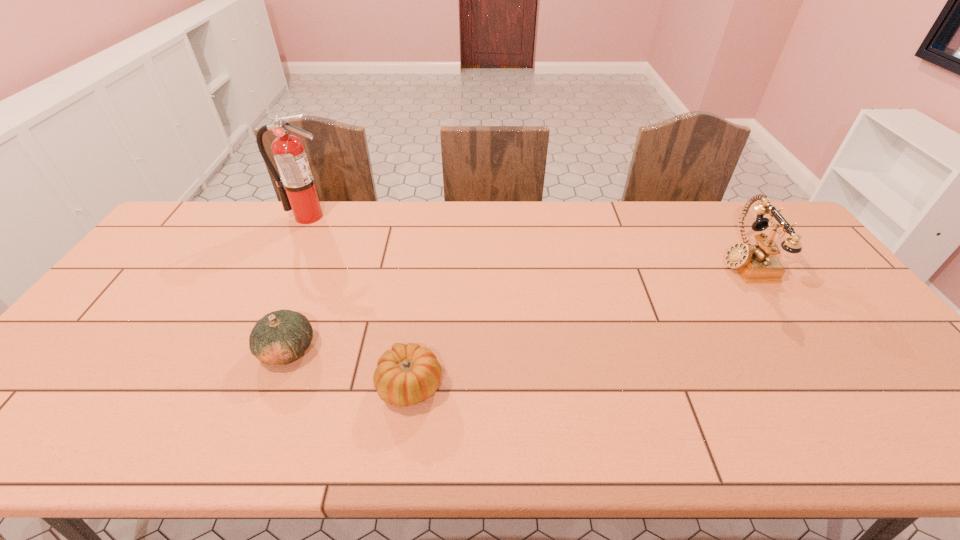
Identify the location of free location located 0.350m on the dial number of the third nearest object. (607, 261).

You are a GUI agent. You are given a task and a screenshot of the screen. Output one action in this format:
    pyautogui.click(x=<x>, y=<y>)
    Task: Click on the vacant space situated 0.170m on the dial number of the third nearest object
    The width and height of the screenshot is (960, 540).
    Given the screenshot: What is the action you would take?
    pyautogui.click(x=665, y=261)

Identify the location of vacant space located on the back of the left gourd. (307, 300).

I want to click on vacant space located 0.360m on the back of the shortest object, so click(427, 264).

The width and height of the screenshot is (960, 540). What are the coordinates of `fire extinguisher located at the far edge` in the screenshot? It's located at (296, 187).

Identify the location of telephone positioned at the far edge. This screenshot has height=540, width=960. (757, 263).

Where is `object present at the near edge`? This screenshot has height=540, width=960. object present at the near edge is located at coordinates (406, 375).

This screenshot has height=540, width=960. I want to click on object located in the right edge section of the desktop, so click(x=757, y=263).

At what (x,y) coordinates should I click in order to perform the action: click on object that is at the far right corner. Please return your answer as a coordinate pair (x, y). The height and width of the screenshot is (540, 960). Looking at the image, I should click on (757, 263).

You are a GUI agent. You are given a task and a screenshot of the screen. Output one action in this format:
    pyautogui.click(x=<x>, y=<y>)
    Task: Click on the free space at the far edge of the desktop
    Image resolution: width=960 pixels, height=540 pixels.
    Given the screenshot: What is the action you would take?
    pyautogui.click(x=642, y=234)